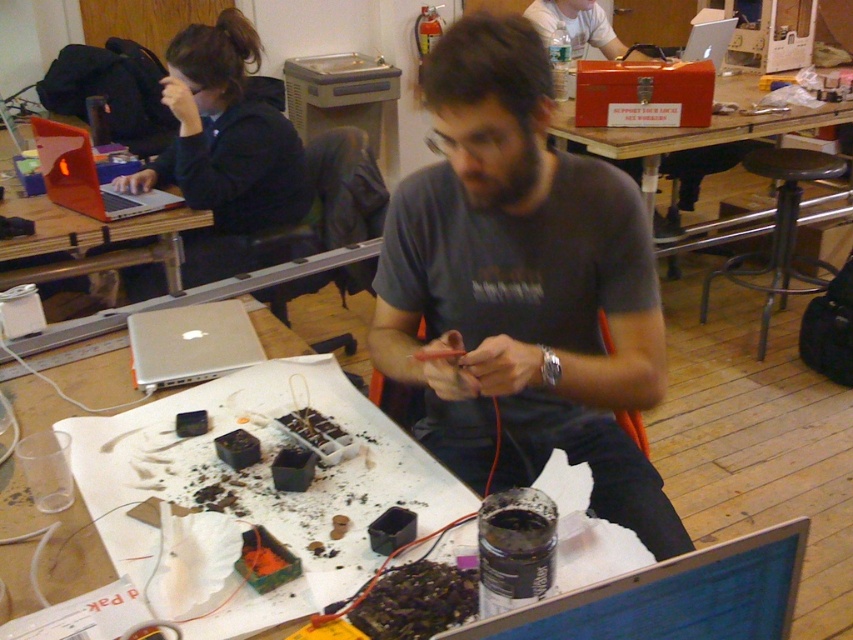
You are a technician in a workshop. You see a black plastic laptop at center and a silver metallic laptop at upper center. Which laptop is located lower in the image?

The black plastic laptop at center is positioned under the silver metallic laptop at upper center, so it is located lower in the image.

You are an engineer in the workshop and need to access both the black plastic laptop at center and the matte black laptop at left. Since you can only reach one at a time, which one would you need to move first to access the other?

The black plastic laptop at center is in front of the matte black laptop at left. To access the matte black laptop at left, you would need to move the black plastic laptop at center first.